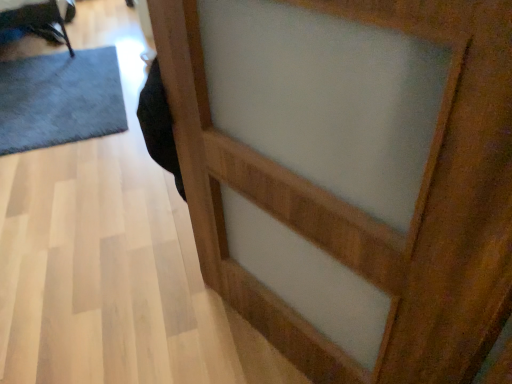
This screenshot has width=512, height=384. What do you see at coordinates (60, 99) in the screenshot?
I see `dark gray carpet at left` at bounding box center [60, 99].

Locate an element on the screen. dark gray carpet at left is located at coordinates (60, 99).

From the picture: In order to face dark gray carpet at left, should I rotate leftwards or rightwards?

Turn left approximately 25.290 degrees to face it.

The image size is (512, 384). Find the location of `wooden barn door at center`. wooden barn door at center is located at coordinates (454, 198).

The width and height of the screenshot is (512, 384). What do you see at coordinates (454, 198) in the screenshot?
I see `wooden barn door at center` at bounding box center [454, 198].

Where is `dark gray carpet at left`? This screenshot has height=384, width=512. dark gray carpet at left is located at coordinates (60, 99).

Which is more to the left, dark gray carpet at left or wooden barn door at center?

dark gray carpet at left is more to the left.

Is dark gray carpet at left behind wooden barn door at center?

Yes, dark gray carpet at left is behind wooden barn door at center.

Is point (4, 90) behind point (439, 263)?

Yes, it is.

From the image's perspective, does dark gray carpet at left appear higher than wooden barn door at center?

Yes, from the image's perspective, dark gray carpet at left is on top of wooden barn door at center.

Looking at this image, from a real-world perspective, is dark gray carpet at left positioned over wooden barn door at center based on gravity?

Incorrect, from a real-world perspective, dark gray carpet at left is lower than wooden barn door at center.

Can you confirm if dark gray carpet at left is thinner than wooden barn door at center?

In fact, dark gray carpet at left might be wider than wooden barn door at center.

Which of these two, dark gray carpet at left or wooden barn door at center, stands shorter?

Standing shorter between the two is dark gray carpet at left.

Is dark gray carpet at left smaller than wooden barn door at center?

No.

Is dark gray carpet at left not inside wooden barn door at center?

Yes, dark gray carpet at left is located beyond the bounds of wooden barn door at center.

Would you say dark gray carpet at left is a long distance from wooden barn door at center?

That's right, there is a large distance between dark gray carpet at left and wooden barn door at center.

Is dark gray carpet at left oriented towards wooden barn door at center?

No, dark gray carpet at left is not facing towards wooden barn door at center.

How many degrees apart are the facing directions of dark gray carpet at left and wooden barn door at center?

dark gray carpet at left and wooden barn door at center are facing 65.4 degrees away from each other.

This screenshot has width=512, height=384. I want to click on barn door below the dark gray carpet at left (from the image's perspective), so click(454, 198).

Considering the positions of objects wooden barn door at center and dark gray carpet at left in the image provided, who is more to the right, wooden barn door at center or dark gray carpet at left?

wooden barn door at center.

Considering the positions of objects wooden barn door at center and dark gray carpet at left in the image provided, who is in front, wooden barn door at center or dark gray carpet at left?

wooden barn door at center is more forward.

Between point (482, 338) and point (18, 66), which one is positioned in front?

Point (482, 338)

From the image's perspective, is wooden barn door at center located above or below dark gray carpet at left?

wooden barn door at center is situated lower than dark gray carpet at left in the image.

From a real-world perspective, is wooden barn door at center positioned above or below dark gray carpet at left?

wooden barn door at center is above dark gray carpet at left.

From the picture: Between wooden barn door at center and dark gray carpet at left, which one has larger width?

dark gray carpet at left.

Who is taller, wooden barn door at center or dark gray carpet at left?

Standing taller between the two is wooden barn door at center.

Between wooden barn door at center and dark gray carpet at left, which one has smaller size?

Smaller between the two is wooden barn door at center.

Is wooden barn door at center spatially inside dark gray carpet at left, or outside of it?

wooden barn door at center cannot be found inside dark gray carpet at left.

Is wooden barn door at center not close to dark gray carpet at left?

Yes, wooden barn door at center and dark gray carpet at left are located far from each other.

Is wooden barn door at center aimed at dark gray carpet at left?

No, wooden barn door at center is not turned towards dark gray carpet at left.

How many degrees apart are the facing directions of wooden barn door at center and dark gray carpet at left?

65.4 degrees.

Where is `doormat behind the wooden barn door at center`? This screenshot has width=512, height=384. doormat behind the wooden barn door at center is located at coordinates (60, 99).

Locate an element on the screen. The image size is (512, 384). doormat that appears above the wooden barn door at center (from the image's perspective) is located at coordinates (60, 99).

Locate an element on the screen. The image size is (512, 384). doormat on the left side of wooden barn door at center is located at coordinates (60, 99).